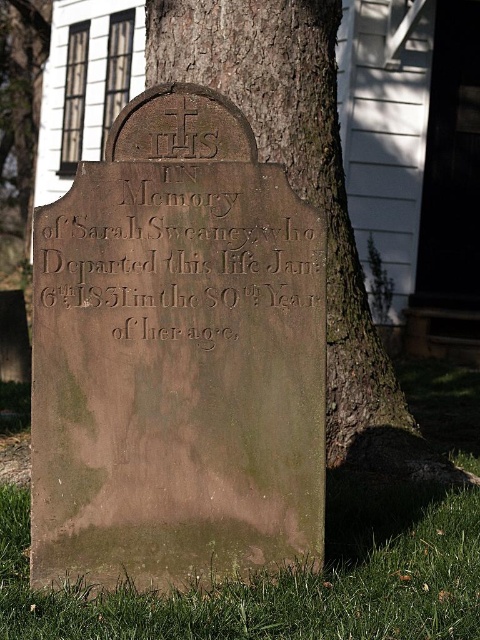
Who is positioned more to the left, brown stone inscription at center or brown rough bark at center?

From the viewer's perspective, brown stone inscription at center appears more on the left side.

Can you confirm if brown stone inscription at center is positioned to the left of brown rough bark at center?

Correct, you'll find brown stone inscription at center to the left of brown rough bark at center.

Is point (202, 248) positioned after point (247, 115)?

That is False.

Identify the location of brown stone inscription at center. (179, 257).

Which is more to the left, green grass at lower center or brown rough bark at center?

From the viewer's perspective, green grass at lower center appears more on the left side.

This screenshot has height=640, width=480. What do you see at coordinates (286, 580) in the screenshot? I see `green grass at lower center` at bounding box center [286, 580].

Find the location of `green grass at lower center`. green grass at lower center is located at coordinates (286, 580).

The height and width of the screenshot is (640, 480). In order to click on green grass at lower center in this screenshot , I will do `click(286, 580)`.

Does brown stone inscription at center have a greater width compared to green grass at lower center?

Incorrect, brown stone inscription at center's width does not surpass green grass at lower center's.

Does brown stone inscription at center have a greater height compared to green grass at lower center?

Yes.

You are a GUI agent. You are given a task and a screenshot of the screen. Output one action in this format:
    pyautogui.click(x=<x>, y=<y>)
    Task: Click on the brown stone inscription at center
    
    Given the screenshot: What is the action you would take?
    pyautogui.click(x=179, y=257)